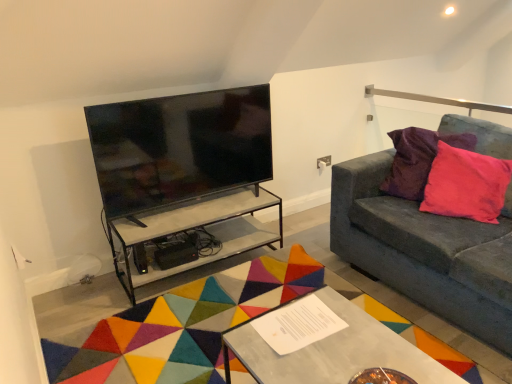
Question: From a real-world perspective, is metallic silver table at center, the second table viewed from the back, positioned above or below clear glass table at center, which appears as the first table when viewed from the back?

Choices:
 (A) below
 (B) above

Answer: (B)

Question: Visually, is metallic silver table at center, which is the first table in front-to-back order, positioned to the left or to the right of clear glass table at center, which appears as the first table when viewed from the back?

Choices:
 (A) right
 (B) left

Answer: (A)

Question: Which object is positioned closest to the pink velvet pillow at right?

Choices:
 (A) velvet grey couch at right
 (B) black glossy tv at upper left
 (C) multicolored felt mat at center
 (D) clear glass table at center, the 2th table viewed from the front
 (E) white paper at center

Answer: (A)

Question: Estimate the real-world distances between objects in this image. Which object is farther from the pink velvet pillow at right?

Choices:
 (A) black glossy tv at upper left
 (B) white paper at center
 (C) velvet grey couch at right
 (D) clear glass table at center, the 2th table viewed from the front
 (E) pink velvet cushion at right

Answer: (B)